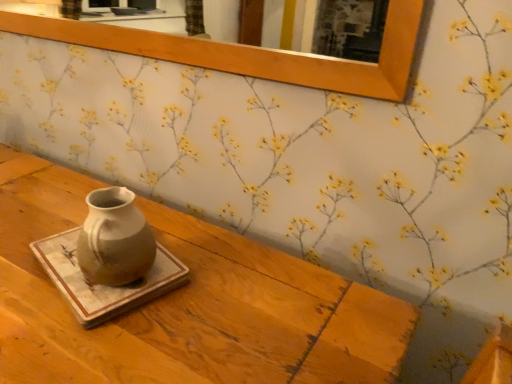
Question: Is point (394, 18) closer or farther from the camera than point (130, 289)?

Choices:
 (A) farther
 (B) closer

Answer: (A)

Question: Is wooden frame at upper center bigger or smaller than marble tray at center?

Choices:
 (A) big
 (B) small

Answer: (A)

Question: Estimate the real-world distances between objects in this image. Which object is closer to the marble tray at center?

Choices:
 (A) wooden frame at upper center
 (B) matte ceramic vase at center

Answer: (B)

Question: Estimate the real-world distances between objects in this image. Which object is closer to the marble tray at center?

Choices:
 (A) wooden frame at upper center
 (B) matte ceramic vase at center

Answer: (B)